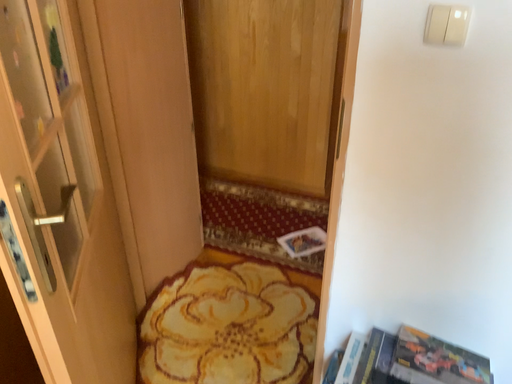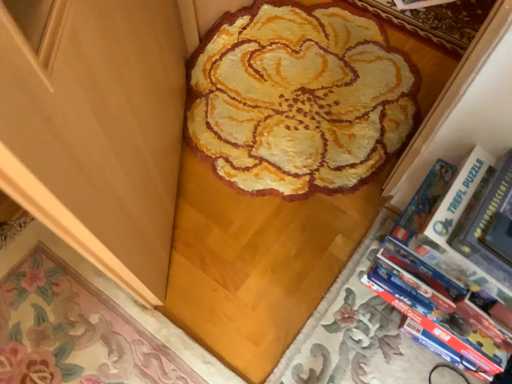
Question: Which way did the camera rotate in the video?

Choices:
 (A) rotated downward
 (B) rotated upward

Answer: (A)